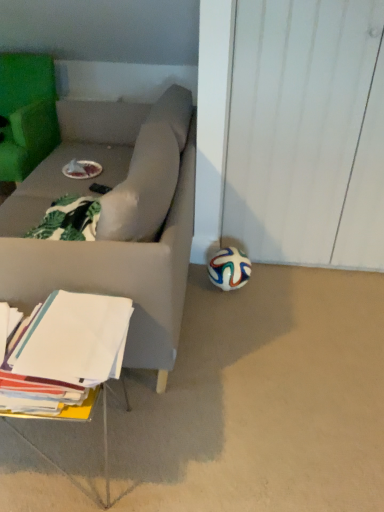
You are a GUI agent. You are given a task and a screenshot of the screen. Output one action in this format:
    pyautogui.click(x=<x>, y=<y>)
    Task: Click on the vacant space to the right of white paper at lower left
    
    Given the screenshot: What is the action you would take?
    pyautogui.click(x=195, y=431)